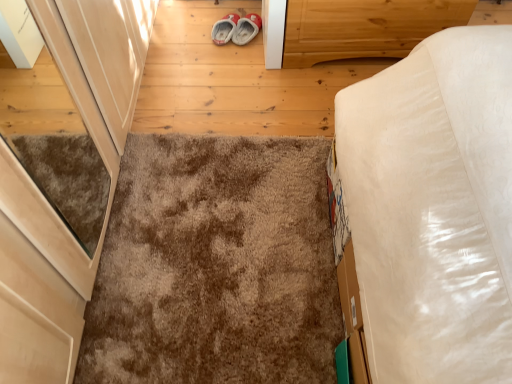
Find the location of a particular element. light brown wood at upper right is located at coordinates (364, 27).

The width and height of the screenshot is (512, 384). Describe the element at coordinates (364, 27) in the screenshot. I see `light brown wood at upper right` at that location.

I want to click on brown shaggy carpet at center, so click(216, 266).

The width and height of the screenshot is (512, 384). What do you see at coordinates (216, 266) in the screenshot? I see `brown shaggy carpet at center` at bounding box center [216, 266].

Find the location of a particular element. This screenshot has height=384, width=512. light brown wood at upper right is located at coordinates (364, 27).

Between brown shaggy carpet at center and light brown wood at upper right, which one appears on the left side from the viewer's perspective?

brown shaggy carpet at center is more to the left.

Is brown shaggy carpet at center positioned before light brown wood at upper right?

Yes, it is.

Between point (97, 378) and point (348, 24), which one is positioned in front?

The point (97, 378) is more forward.

From the image's perspective, is brown shaggy carpet at center positioned above or below light brown wood at upper right?

From the image's perspective, brown shaggy carpet at center appears below light brown wood at upper right.

From a real-world perspective, is brown shaggy carpet at center physically below light brown wood at upper right?

Yes, from a real-world perspective, brown shaggy carpet at center is beneath light brown wood at upper right.

Can you confirm if brown shaggy carpet at center is wider than light brown wood at upper right?

Yes.

Considering the sizes of objects brown shaggy carpet at center and light brown wood at upper right in the image provided, who is shorter, brown shaggy carpet at center or light brown wood at upper right?

Standing shorter between the two is brown shaggy carpet at center.

Can you confirm if brown shaggy carpet at center is smaller than light brown wood at upper right?

Yes.

Would you say brown shaggy carpet at center is inside or outside light brown wood at upper right?

brown shaggy carpet at center is spatially situated outside light brown wood at upper right.

Are brown shaggy carpet at center and light brown wood at upper right located far from each other?

brown shaggy carpet at center is near light brown wood at upper right, not far away.

Does brown shaggy carpet at center turn towards light brown wood at upper right?

No, brown shaggy carpet at center is not facing towards light brown wood at upper right.

How many degrees apart are the facing directions of brown shaggy carpet at center and light brown wood at upper right?

brown shaggy carpet at center and light brown wood at upper right are facing 175 degrees away from each other.

How distant is brown shaggy carpet at center from light brown wood at upper right?

brown shaggy carpet at center and light brown wood at upper right are 34.97 inches apart.

The width and height of the screenshot is (512, 384). I want to click on mat below the light brown wood at upper right (from a real-world perspective), so click(216, 266).

In the image, is light brown wood at upper right on the left side or the right side of brown shaggy carpet at center?

Based on their positions, light brown wood at upper right is located to the right of brown shaggy carpet at center.

Based on the photo, does light brown wood at upper right lie behind brown shaggy carpet at center?

Yes, the depth of light brown wood at upper right is greater than that of brown shaggy carpet at center.

Considering the points (367, 14) and (170, 316), which point is behind, point (367, 14) or point (170, 316)?

The point (367, 14) is farther from the camera.

From the image's perspective, which one is positioned higher, light brown wood at upper right or brown shaggy carpet at center?

light brown wood at upper right, from the image's perspective.

From a real-world perspective, between light brown wood at upper right and brown shaggy carpet at center, who is vertically higher?

light brown wood at upper right, from a real-world perspective.

Which of these two, light brown wood at upper right or brown shaggy carpet at center, is thinner?

Thinner between the two is light brown wood at upper right.

Which of these two, light brown wood at upper right or brown shaggy carpet at center, stands taller?

light brown wood at upper right.

Does light brown wood at upper right have a smaller size compared to brown shaggy carpet at center?

Incorrect, light brown wood at upper right is not smaller in size than brown shaggy carpet at center.

Would you say light brown wood at upper right is outside brown shaggy carpet at center?

Yes.

Is the surface of light brown wood at upper right in direct contact with brown shaggy carpet at center?

There is a gap between light brown wood at upper right and brown shaggy carpet at center.

Could you tell me if light brown wood at upper right is facing brown shaggy carpet at center?

Yes, light brown wood at upper right faces towards brown shaggy carpet at center.

How many degrees apart are the facing directions of light brown wood at upper right and brown shaggy carpet at center?

They differ by 175 degrees in their facing directions.

This screenshot has width=512, height=384. I want to click on mat on the left of light brown wood at upper right, so click(x=216, y=266).

This screenshot has width=512, height=384. Identify the location of mat on the left of the light brown wood at upper right. (216, 266).

Locate an element on the screen. cabinetry lying on the right of brown shaggy carpet at center is located at coordinates (364, 27).